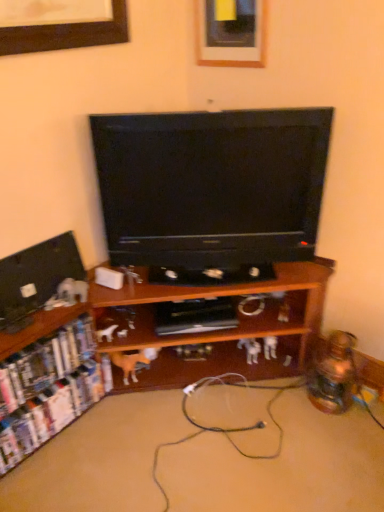
The width and height of the screenshot is (384, 512). I want to click on vacant space underneath wooden shelf at center, the second shelf positioned from the left (from a real-world perspective), so click(x=150, y=438).